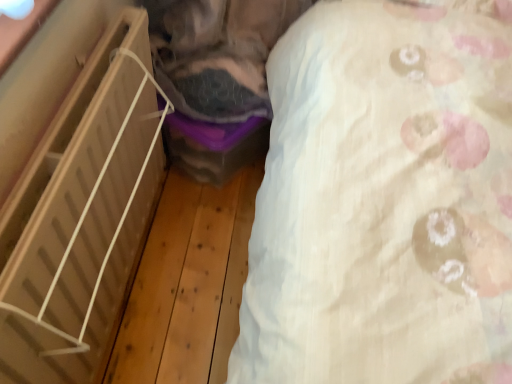
Question: From a real-world perspective, is white textured sheet at upper right positioned above or below light wood shelf at left?

Choices:
 (A) below
 (B) above

Answer: (B)

Question: Visually, is white textured sheet at upper right positioned to the left or to the right of light wood shelf at left?

Choices:
 (A) left
 (B) right

Answer: (B)

Question: Considering the positions of white textured sheet at upper right and light wood shelf at left in the image, is white textured sheet at upper right wider or thinner than light wood shelf at left?

Choices:
 (A) wide
 (B) thin

Answer: (B)

Question: From their relative heights in the image, would you say light wood shelf at left is taller or shorter than white textured sheet at upper right?

Choices:
 (A) short
 (B) tall

Answer: (A)

Question: In terms of size, does light wood shelf at left appear bigger or smaller than white textured sheet at upper right?

Choices:
 (A) big
 (B) small

Answer: (A)

Question: Do you think light wood shelf at left is within white textured sheet at upper right, or outside of it?

Choices:
 (A) inside
 (B) outside

Answer: (B)

Question: Would you say light wood shelf at left is to the left or to the right of white textured sheet at upper right in the picture?

Choices:
 (A) left
 (B) right

Answer: (A)